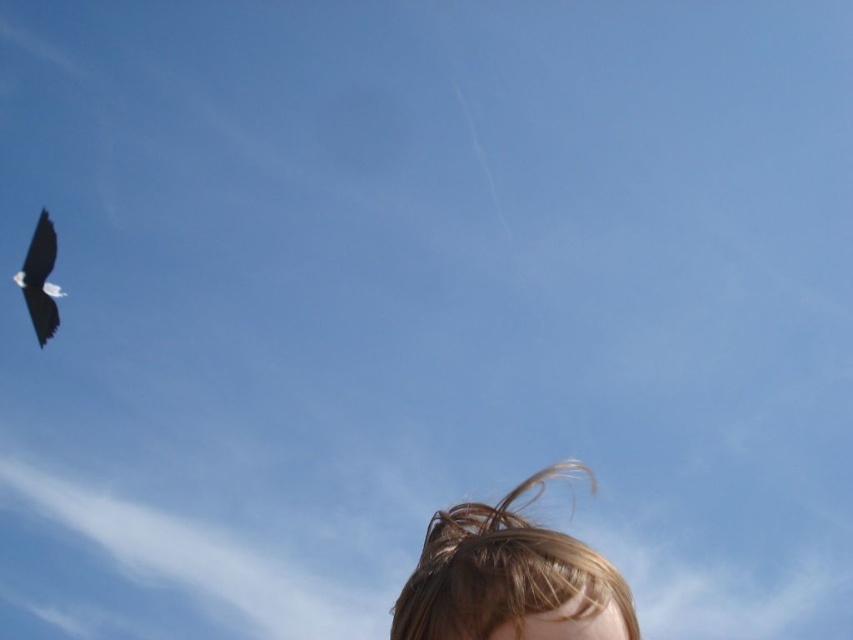
Question: Among these objects, which one is nearest to the camera?

Choices:
 (A) blonde hair at lower center
 (B) black glossy bird at upper left

Answer: (A)

Question: Does blonde hair at lower center lie behind black glossy bird at upper left?

Choices:
 (A) no
 (B) yes

Answer: (A)

Question: Which object is farther from the camera taking this photo?

Choices:
 (A) black glossy bird at upper left
 (B) blonde hair at lower center

Answer: (A)

Question: Is blonde hair at lower center further to camera compared to black glossy bird at upper left?

Choices:
 (A) no
 (B) yes

Answer: (A)

Question: In this image, where is blonde hair at lower center located relative to black glossy bird at upper left?

Choices:
 (A) above
 (B) below

Answer: (B)